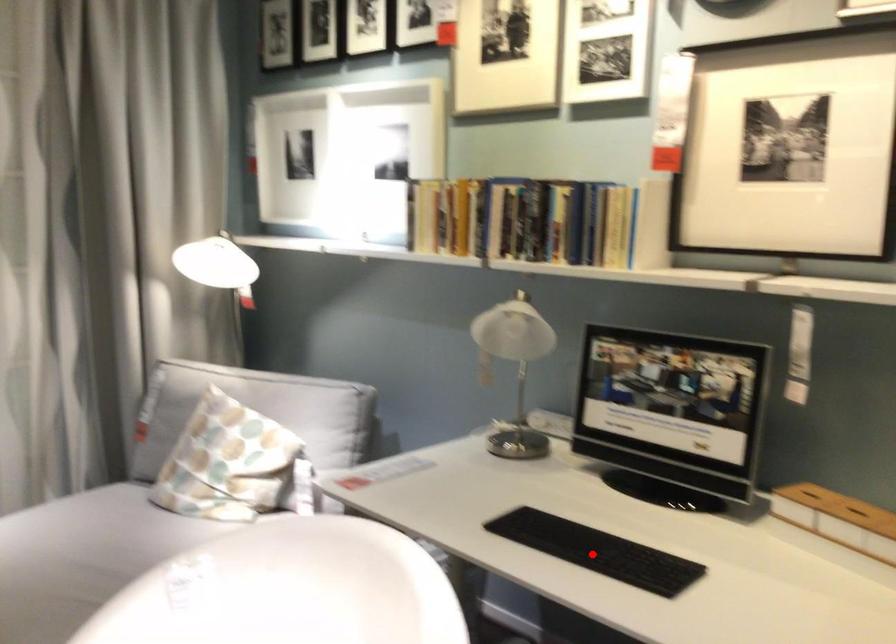
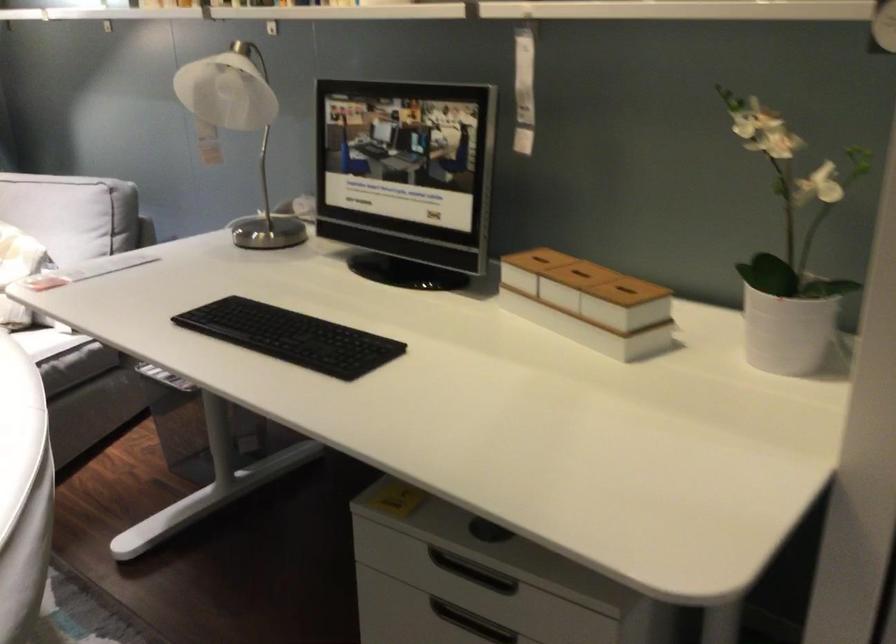
Question: I am providing you with two images of the same scene from different viewpoints. A red point is marked on the first image. Can you still see the location of the red point in image 2?

Choices:
 (A) Yes
 (B) No

Answer: (A)